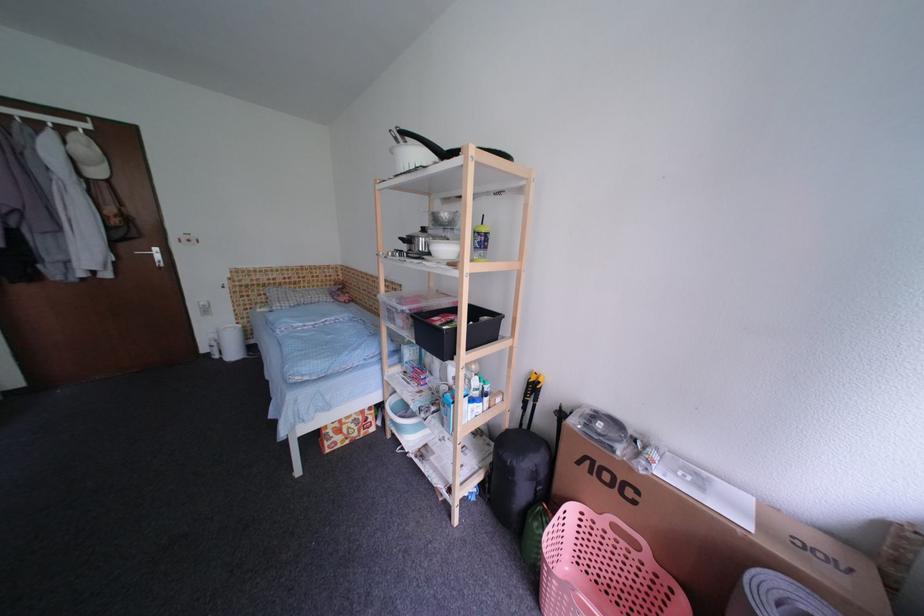
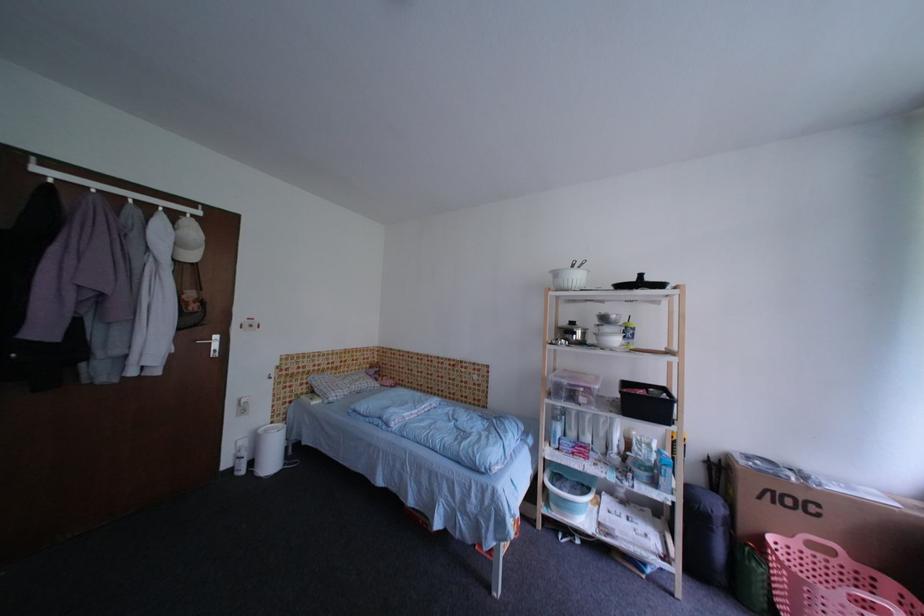
Question: Which direction would the cameraman need to move to produce the second image? Reply with the corresponding letter.

Choices:
 (A) Left
 (B) Right
 (C) Forward
 (D) Backward

Answer: (A)